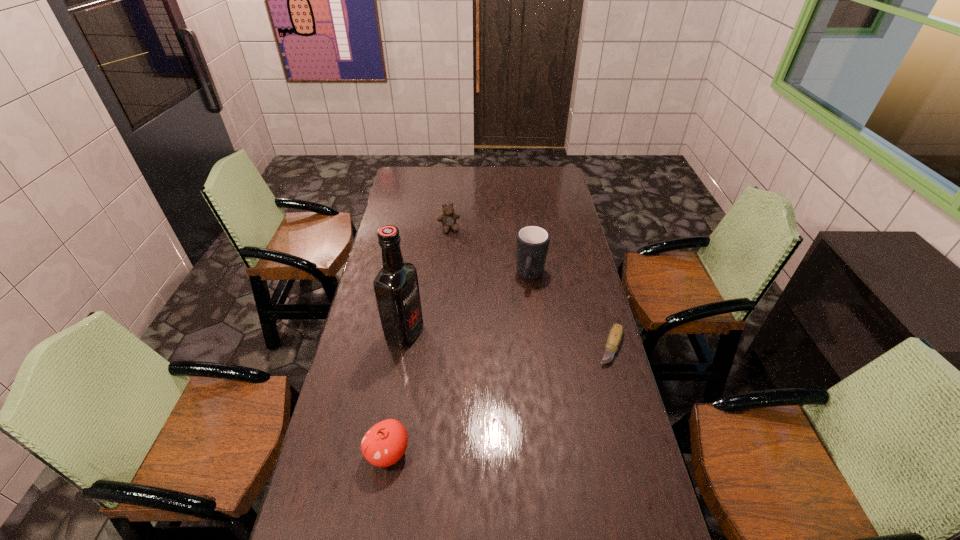
The image size is (960, 540). I want to click on vacant spot on the desktop that is between the nearest object and the pocketknife and is positioned on the side of the mug with the handle, so click(x=503, y=399).

Find the location of a particular element. The image size is (960, 540). vacant space on the desktop that is between the nearest object and the pocketknife and is positioned on the face of the teddy bear is located at coordinates (515, 393).

Find the location of a particular element. vacant spot on the desktop that is between the nearest object and the rightmost object and is positioned on the front-facing side of the tallest object is located at coordinates (542, 380).